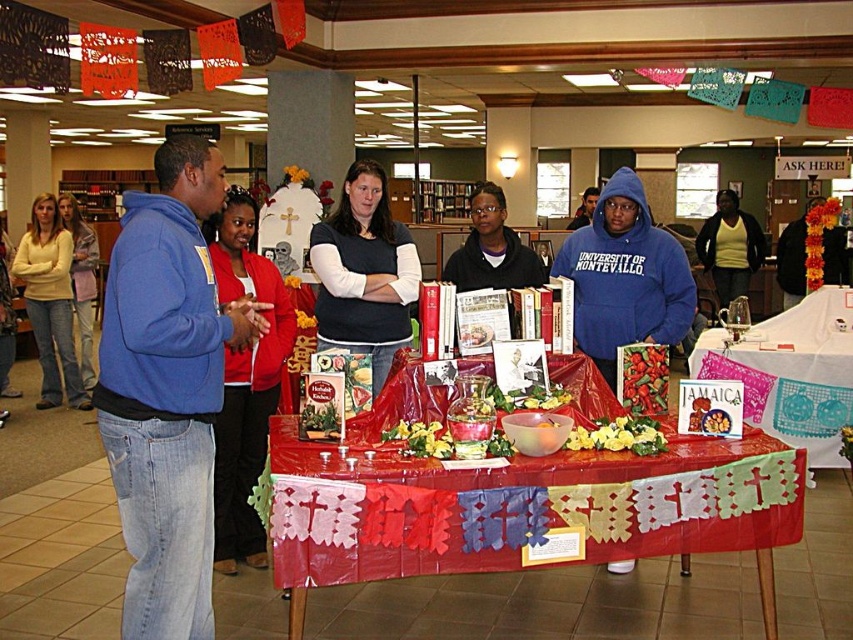
Question: Is blue fleece hoodie at left positioned before red paper tablecloth at center?

Choices:
 (A) yes
 (B) no

Answer: (A)

Question: Where is red paper tablecloth at center located in relation to matte yellow sweater at center in the image?

Choices:
 (A) left
 (B) right

Answer: (A)

Question: Does red plastic table at center appear on the left side of blue fleece hoodie at left?

Choices:
 (A) no
 (B) yes

Answer: (A)

Question: Among these points, which one is nearest to the camera?

Choices:
 (A) (735, 266)
 (B) (172, 170)

Answer: (B)

Question: Based on their relative distances, which object is nearer to the matte black sweater at center?

Choices:
 (A) matte yellow sweater at left
 (B) matte yellow sweater at center
 (C) red paper tablecloth at center

Answer: (C)

Question: Which point appears closest to the camera in this image?

Choices:
 (A) (82, 221)
 (B) (120, 289)

Answer: (B)